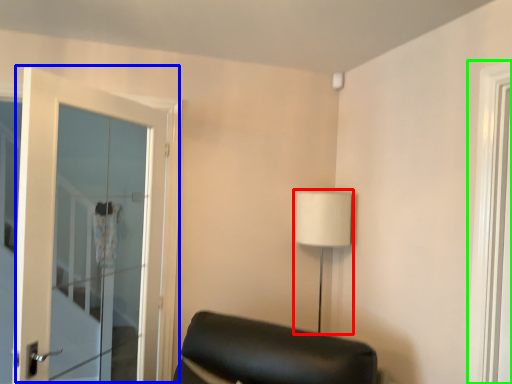
Question: Which object is positioned closest to table lamp (highlighted by a red box)? Select from door (highlighted by a blue box) and window (highlighted by a green box).

Choices:
 (A) door
 (B) window

Answer: (B)